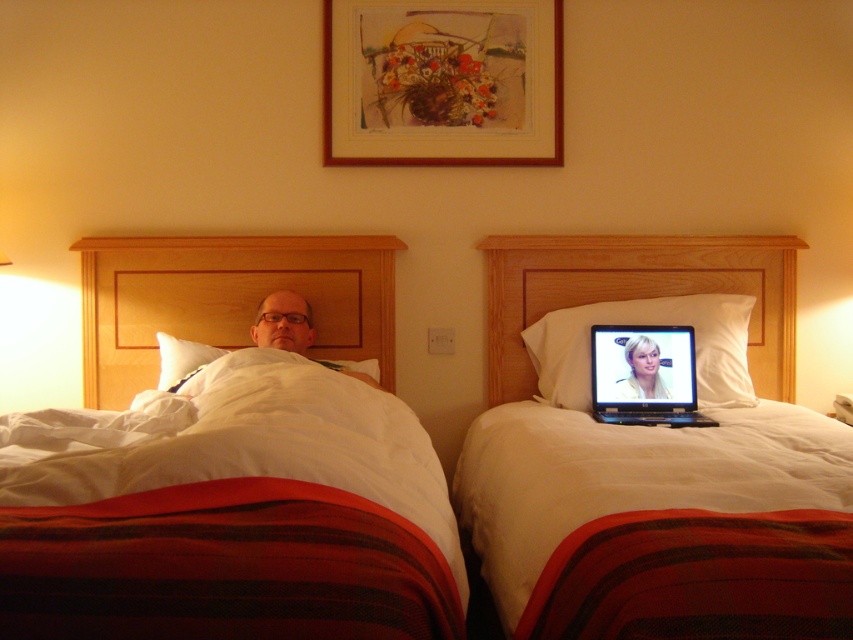
You are standing in a hotel room and want to reach the white soft bed at upper center. If you can walk 10 feet in 3 seconds, how long will it take you to get there?

The white soft bed at upper center is 9.13 feet away from the viewer. Since you can walk 10 feet in 3 seconds, it will take you approximately 2.74 seconds to reach the bed.

You are standing in the hotel room and want to reach the point marked at coordinates point (341, 99). If you can move forward 9 feet, will you be able to reach that point?

The distance between you and point (341, 99) is 9.12 feet. Since you can move forward 9 feet, you won???t quite reach the point as you???ll be 0.12 feet short.

From the picture: You are a hotel guest who wants to hang a new picture frame on the wall between the two beds. The new frame is the same size as the wooden picture frame at upper center. Can you fit it next to the matte black man at center without overlapping?

The wooden picture frame at upper center occupies less space than the matte black man at center. Since the new frame is the same size as the wooden picture frame at upper center, it would take up even less space than the matte black man at center. Therefore, you can fit it next to the matte black man at center without overlapping.